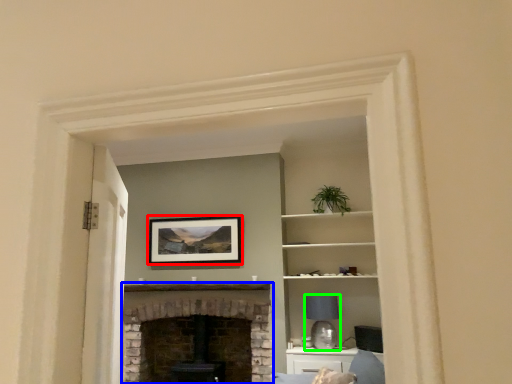
Question: Considering the real-world distances, which object is closest to picture frame (highlighted by a red box)? fireplace (highlighted by a blue box) or lamp (highlighted by a green box).

Choices:
 (A) fireplace
 (B) lamp

Answer: (A)